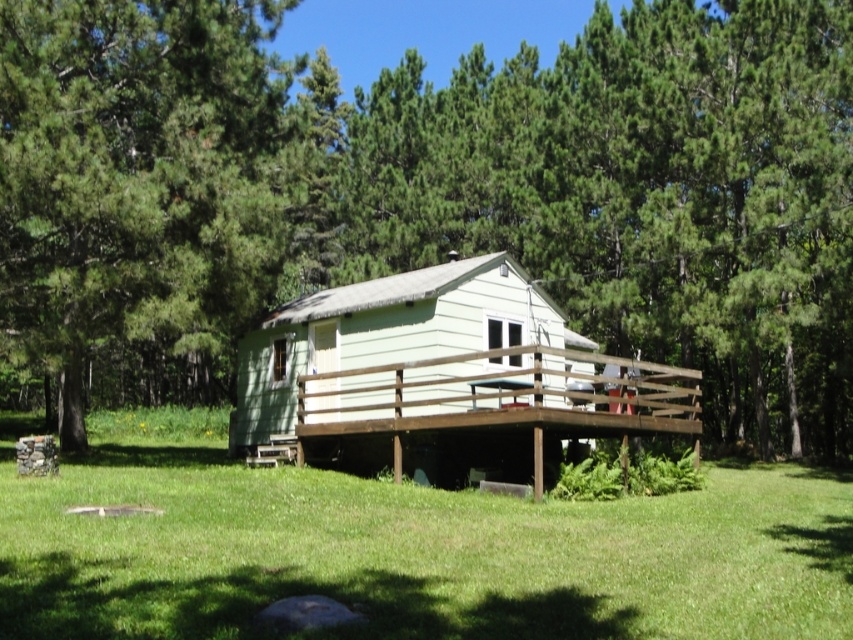
Question: Which point appears closest to the camera in this image?

Choices:
 (A) (68, 378)
 (B) (601, 193)
 (C) (403, 355)

Answer: (C)

Question: Can you confirm if green textured tree at upper left is smaller than light green siding at center?

Choices:
 (A) no
 (B) yes

Answer: (A)

Question: Is green leafy tree at center above green grass at center?

Choices:
 (A) yes
 (B) no

Answer: (A)

Question: Which point is closer to the camera?

Choices:
 (A) light green siding at center
 (B) green textured tree at upper left
 (C) green leafy tree at center

Answer: (B)

Question: Which point is closer to the camera taking this photo?

Choices:
 (A) (82, 76)
 (B) (318, 406)

Answer: (A)

Question: Does green leafy tree at center appear on the left side of green textured tree at upper left?

Choices:
 (A) yes
 (B) no

Answer: (B)